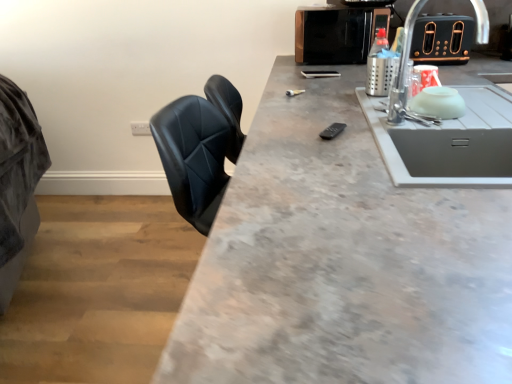
Identify the location of vacant area that is situated to the right of white matte sink at right. This screenshot has height=384, width=512. (462, 134).